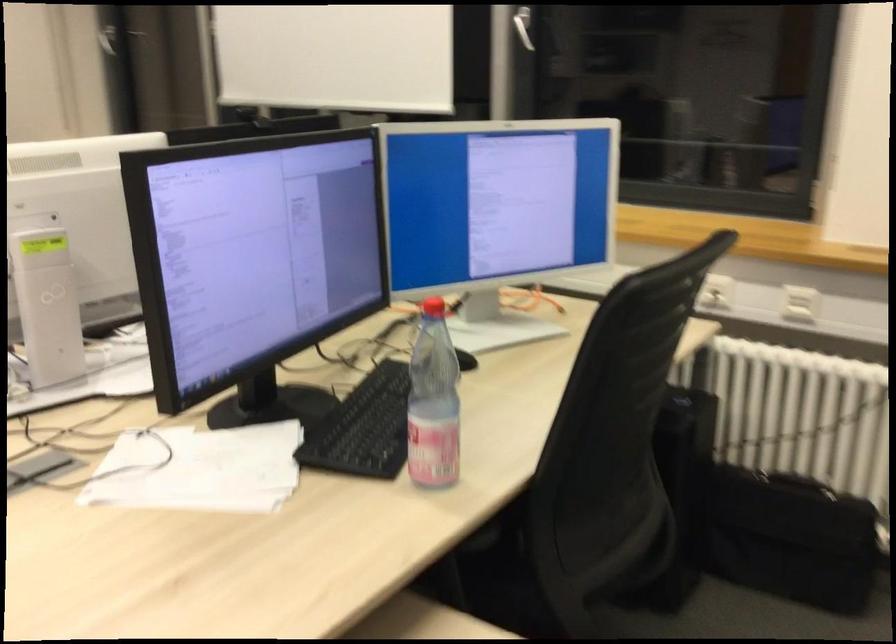
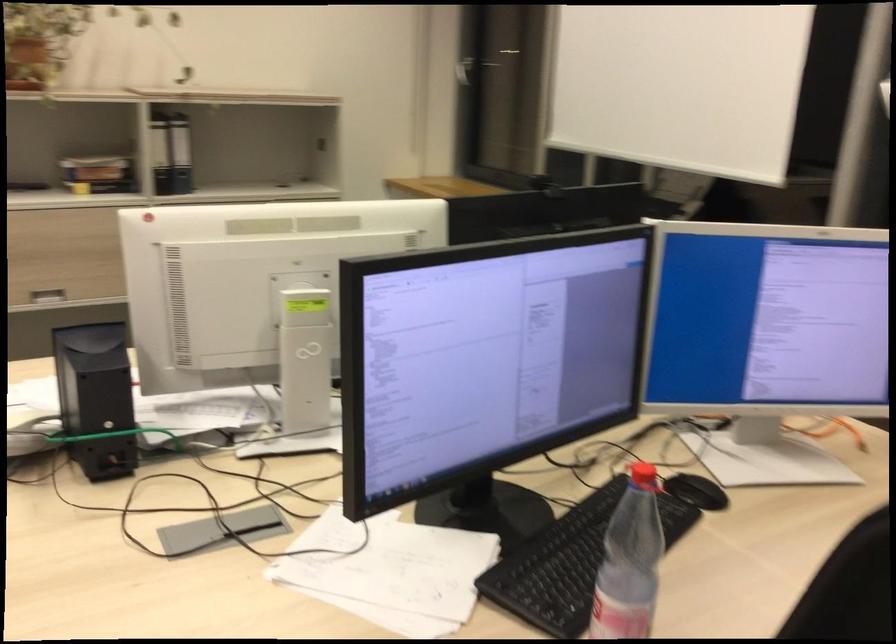
In the second image, find the point that corresponds to the point at 434,310 in the first image.

(642, 478)